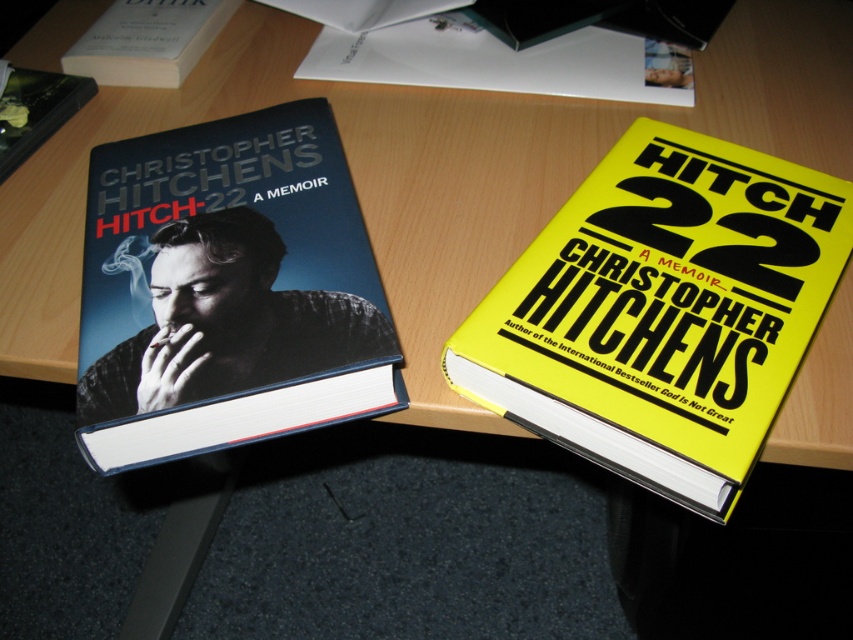
Question: Considering the relative positions of matte black book cover at left and white paper at upper left in the image provided, where is matte black book cover at left located with respect to white paper at upper left?

Choices:
 (A) right
 (B) left

Answer: (A)

Question: Does white paper at upper center have a greater width compared to white paper at upper left?

Choices:
 (A) yes
 (B) no

Answer: (A)

Question: Does matte black book cover at left have a smaller size compared to white paper at upper center?

Choices:
 (A) no
 (B) yes

Answer: (A)

Question: Which point is farther to the camera?

Choices:
 (A) yellow matte book at center
 (B) white paper at upper left
 (C) white paper at upper center

Answer: (B)

Question: Which of the following is the farthest from the observer?

Choices:
 (A) yellow matte book at center
 (B) white paper at upper center

Answer: (B)

Question: Among these objects, which one is nearest to the camera?

Choices:
 (A) white paper at upper left
 (B) matte black book cover at left
 (C) yellow matte book at center
 (D) white paper at upper center

Answer: (C)